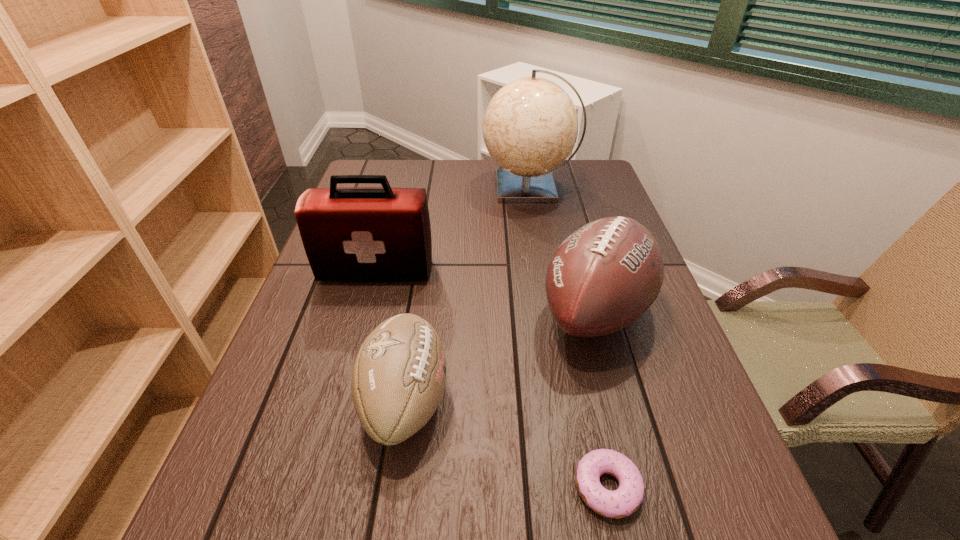
Where is `unoccupied area between the first aid kit and the tallest object`? This screenshot has width=960, height=540. unoccupied area between the first aid kit and the tallest object is located at coordinates (453, 230).

This screenshot has height=540, width=960. Identify the location of free space between the third tallest object and the first aid kit. (486, 292).

Find the location of a particular element. free point between the first aid kit and the doughnut is located at coordinates (492, 379).

Identify which object is the third nearest to the globe. Please provide its 2D coordinates. Your answer should be formatted as a tuple, i.e. [(x, y)], where the tuple contains the x and y coordinates of a point satisfying the conditions above.

[(399, 375)]

Identify the location of object that is the closest to the first aid kit. (399, 375).

Locate an element on the screen. free region that satisfies the following two spatial constraints: 1. on the surface of the doughnut showing Europe and Africa; 2. on the left side of the globe is located at coordinates (579, 487).

Locate an element on the screen. vacant space that satisfies the following two spatial constraints: 1. on the laces of the shortest object; 2. on the right side of the shorter football (American) is located at coordinates (393, 487).

Find the location of a particular element. Image resolution: width=960 pixels, height=540 pixels. vacant region that satisfies the following two spatial constraints: 1. on the side of the first aid kit with the cross symbol; 2. on the right side of the taller football (American) is located at coordinates (366, 312).

Locate an element on the screen. This screenshot has width=960, height=540. vacant space that satisfies the following two spatial constraints: 1. on the side of the first aid kit with the cross symbol; 2. on the right side of the right football (American) is located at coordinates (366, 312).

Identify the location of vacant region that satisfies the following two spatial constraints: 1. on the back side of the right football (American); 2. on the surface of the globe showing Europe and Africa. (562, 187).